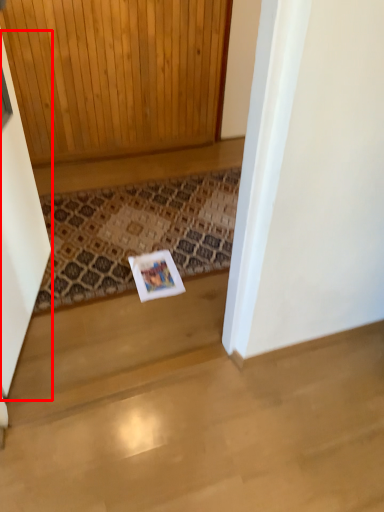
Question: From the image's perspective, what is the correct spatial positioning of screen door (annotated by the red box) in reference to doormat?

Choices:
 (A) below
 (B) above

Answer: (B)